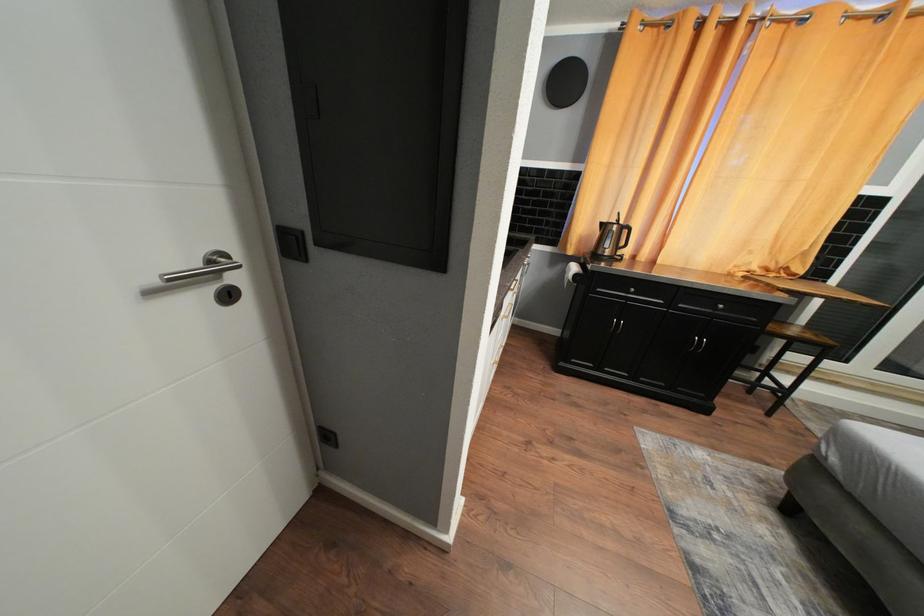
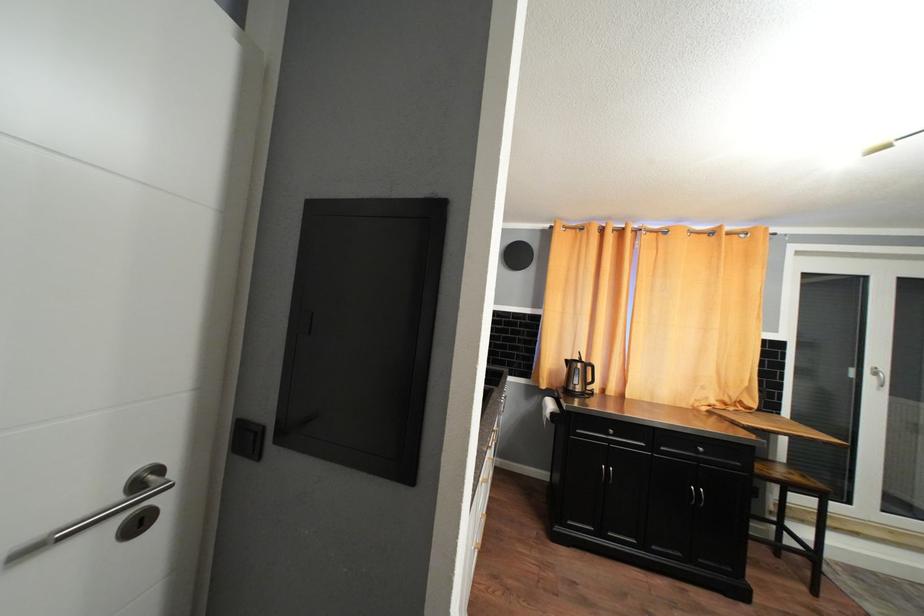
Question: How did the camera likely rotate?

Choices:
 (A) Left
 (B) Right
 (C) Up
 (D) Down

Answer: (C)